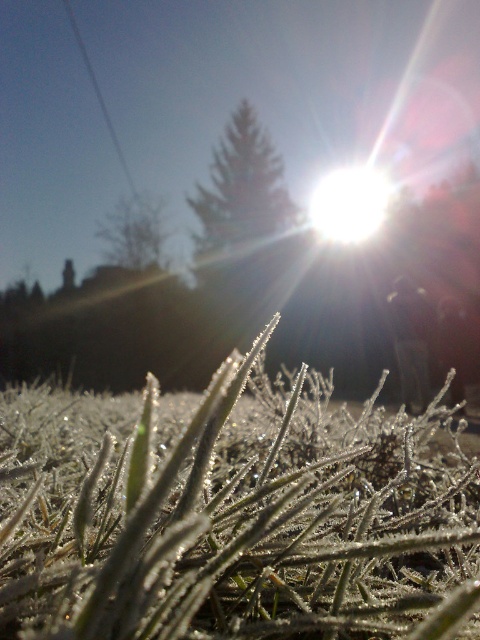
Does frosted glass at center appear on the right side of green textured pine tree at center?

Indeed, frosted glass at center is positioned on the right side of green textured pine tree at center.

You are a GUI agent. You are given a task and a screenshot of the screen. Output one action in this format:
    pyautogui.click(x=<x>, y=<y>)
    Task: Click on the frosted glass at center
    The image size is (480, 640).
    Given the screenshot: What is the action you would take?
    pyautogui.click(x=235, y=513)

Between green textured pine tree at center and green matte tree at upper center, which one appears on the right side from the viewer's perspective?

green textured pine tree at center is more to the right.

Is point (243, 163) positioned behind point (130, 209)?

That is True.

Find the location of `green textured pine tree at center`. green textured pine tree at center is located at coordinates (241, 188).

Can you confirm if frosted glass at center is positioned above green matte tree at upper center?

Actually, frosted glass at center is below green matte tree at upper center.

Where is `frosted glass at center`? frosted glass at center is located at coordinates (235, 513).

This screenshot has height=640, width=480. What do you see at coordinates (235, 513) in the screenshot?
I see `frosted glass at center` at bounding box center [235, 513].

The image size is (480, 640). I want to click on frosted glass at center, so click(x=235, y=513).